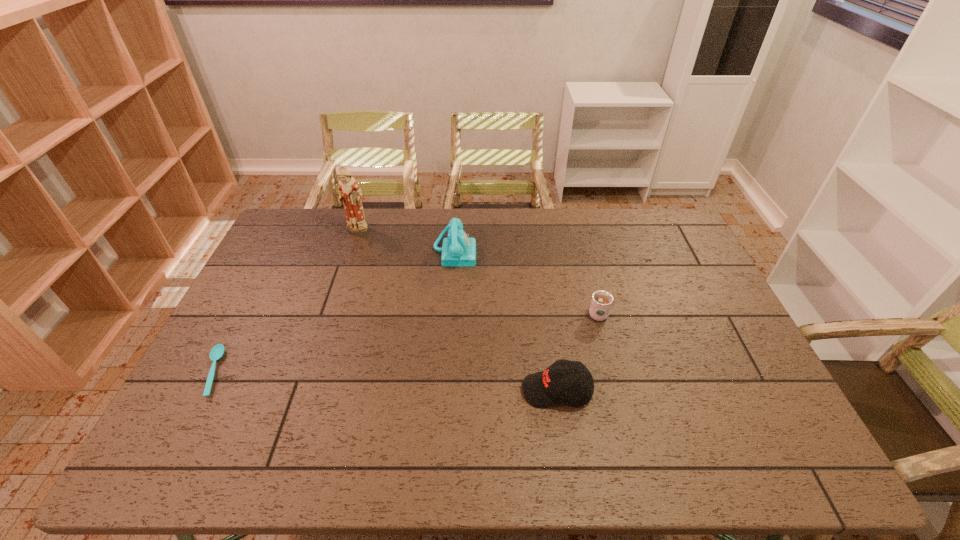
Where is `unoccupied area between the leftmost object and the third object from left to right`? unoccupied area between the leftmost object and the third object from left to right is located at coordinates (334, 312).

Locate an element on the screen. vacant area that lies between the telephone and the second object from right to left is located at coordinates (506, 321).

The width and height of the screenshot is (960, 540). What are the coordinates of `empty location between the fourth shortest object and the baseball cap` in the screenshot? It's located at (506, 321).

Identify the location of free spot between the second object from left to right and the second tallest object. click(x=406, y=242).

You are a GUI agent. You are given a task and a screenshot of the screen. Output one action in this format:
    pyautogui.click(x=<x>, y=<y>)
    Task: Click on the free point between the second object from left to right and the baseball cap
    The height and width of the screenshot is (540, 960).
    Given the screenshot: What is the action you would take?
    pyautogui.click(x=457, y=312)

Where is `vacant space that is in between the third nearest object and the fourth object from left to right`? Image resolution: width=960 pixels, height=540 pixels. vacant space that is in between the third nearest object and the fourth object from left to right is located at coordinates (577, 352).

Identify which object is the nearest to the spoon. Please provide its 2D coordinates. Your answer should be formatted as a tuple, i.e. [(x, y)], where the tuple contains the x and y coordinates of a point satisfying the conditions above.

[(350, 194)]

Locate an element on the screen. This screenshot has width=960, height=540. object that is the second closest one to the shortest object is located at coordinates (459, 250).

In order to click on free space that satisfies the following two spatial constraints: 1. on the dial of the third object from right to left; 2. on the side with the handle of the third nearest object in this screenshot , I will do `click(450, 313)`.

The width and height of the screenshot is (960, 540). What are the coordinates of `vacant space that satisfies the following two spatial constraints: 1. on the dial of the second tallest object; 2. on the side with the handle of the third nearest object` in the screenshot? It's located at (450, 313).